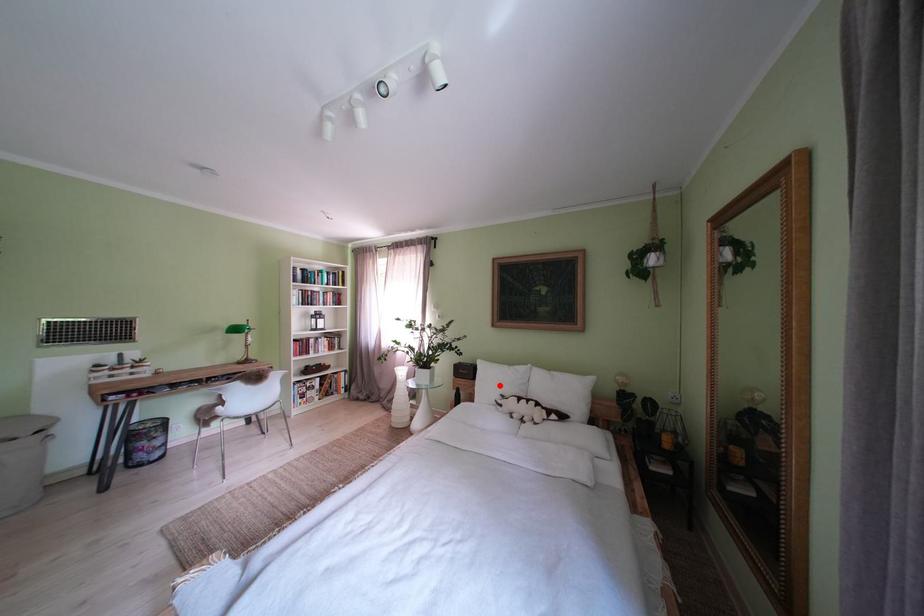
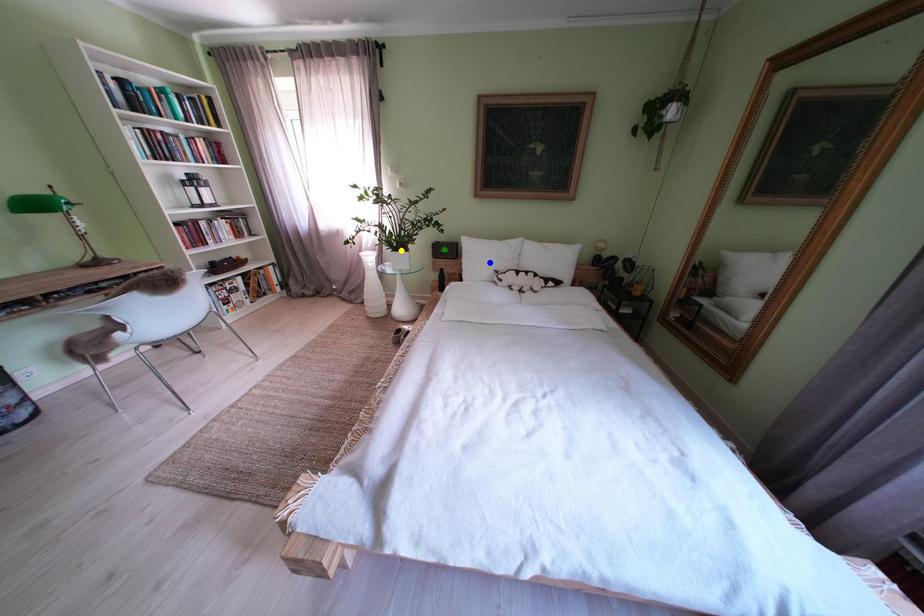
Question: I am providing you with two images of the same scene from different viewpoints. A red point is marked on the first image. You are given multiple points on the second image. Which spot in image 2 lines up with the point in image 1?

Choices:
 (A) yellow point
 (B) green point
 (C) blue point

Answer: (C)